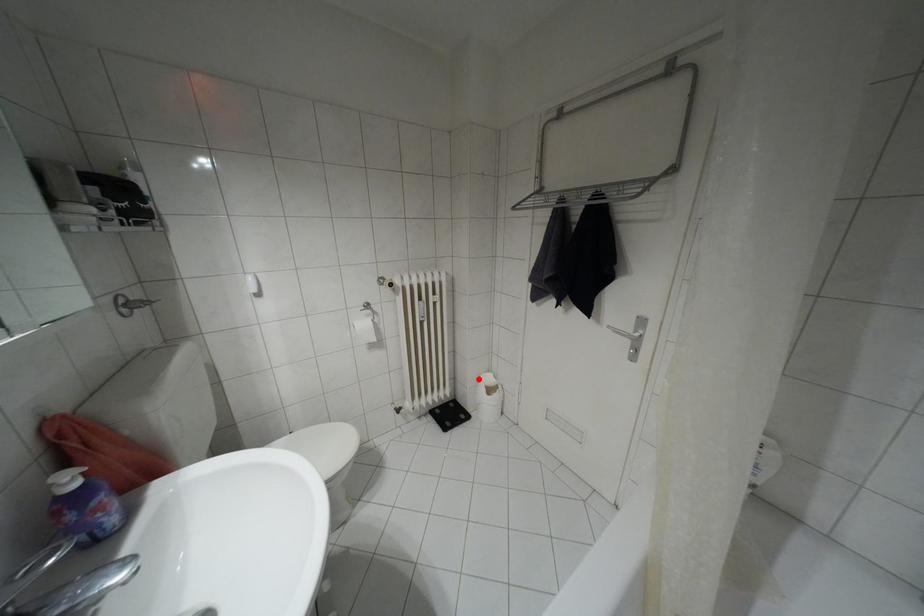
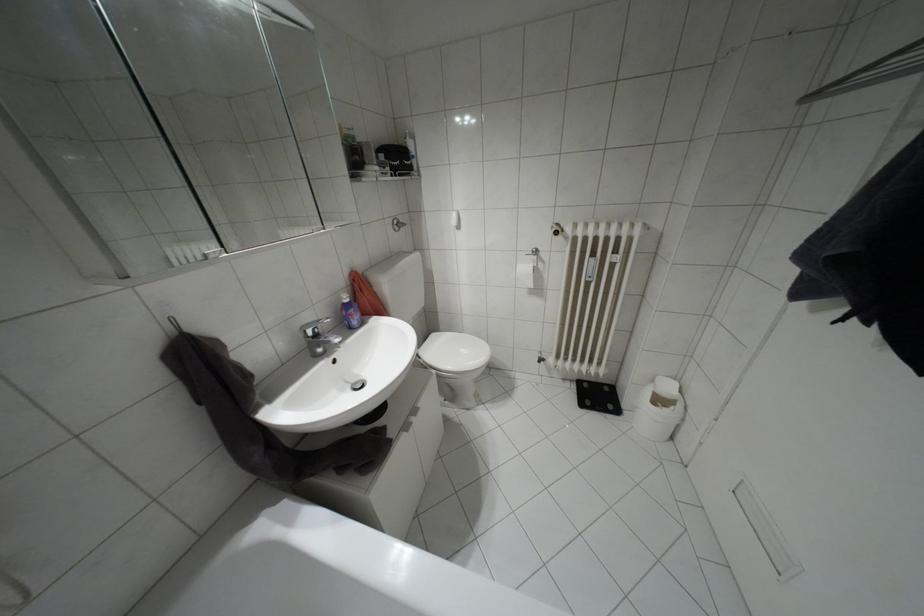
Find the pixel in the second image that matches the highlighted location in the first image.

(652, 379)